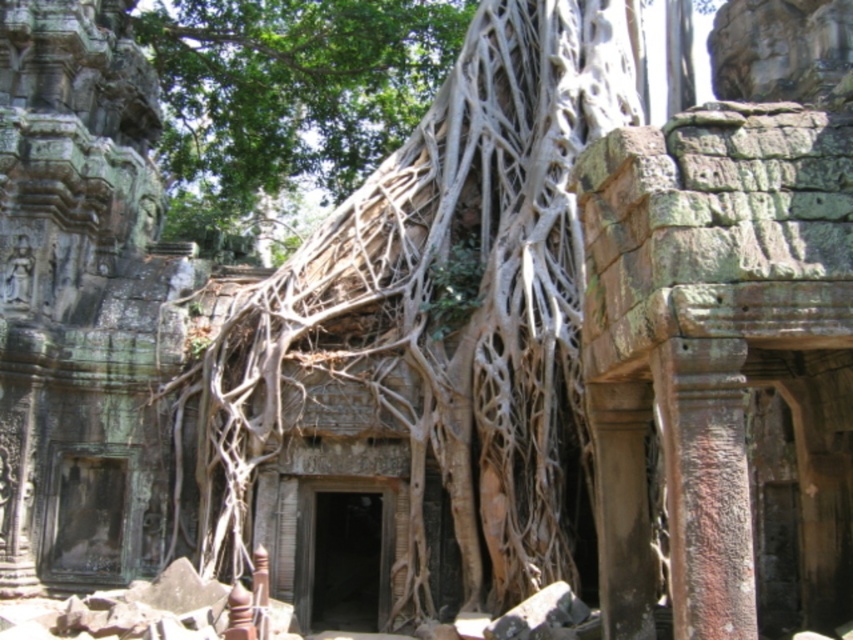
Is brown textured roots at center bigger than gray stone carving at left?

Yes, brown textured roots at center is bigger than gray stone carving at left.

Which is behind, point (241, 488) or point (129, 428)?

Point (129, 428)

Locate an element on the screen. brown textured roots at center is located at coordinates coord(444,307).